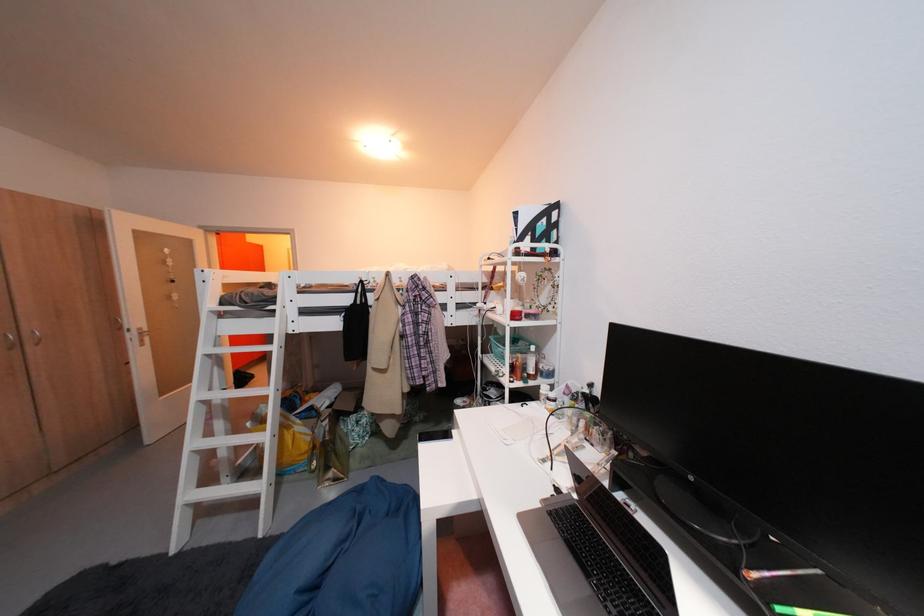
Find the location of a particular element. Image resolution: width=924 pixels, height=616 pixels. white ladder rung is located at coordinates (228, 402).